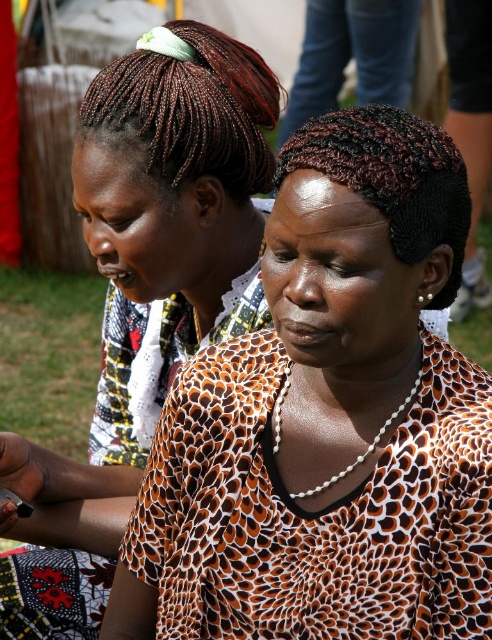
Is printed fabric blouse at center bigger than braided dark brown hair at upper left?

Yes, printed fabric blouse at center is bigger than braided dark brown hair at upper left.

Is printed fabric blouse at center above braided dark brown hair at upper left?

No.

The image size is (492, 640). I want to click on printed fabric blouse at center, so click(328, 420).

Who is more distant from viewer, (x=25, y=620) or (x=200, y=92)?

The point (x=25, y=620) is more distant.

Between matte leopard print blouse at center and braided dark brown hair at upper left, which one has less height?

braided dark brown hair at upper left is shorter.

Between point (200, 321) and point (264, 76), which one is positioned behind?

Positioned behind is point (200, 321).

Identify the location of matte leopard print blouse at center. (143, 296).

Does point (270, 410) lie behind point (446, 216)?

Yes, it is behind point (446, 216).

Can you confirm if printed fabric blouse at center is positioned to the right of black braided hair at center?

No, printed fabric blouse at center is not to the right of black braided hair at center.

The image size is (492, 640). In order to click on printed fabric blouse at center in this screenshot , I will do `click(328, 420)`.